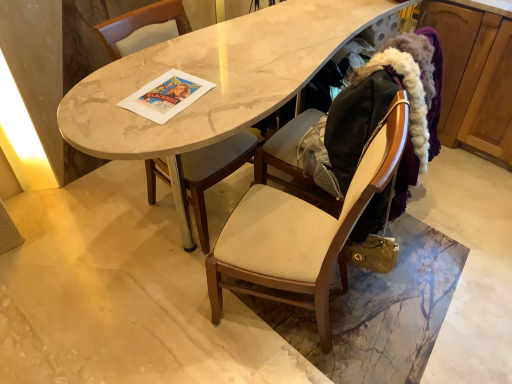
What do you see at coordinates (301, 233) in the screenshot? I see `beige fabric chair at center, marked as the 2th chair in a left-to-right arrangement` at bounding box center [301, 233].

Locate an element on the screen. The image size is (512, 384). marble table at center is located at coordinates (213, 82).

Describe the element at coordinates (474, 79) in the screenshot. I see `wooden cabinet at right` at that location.

What do you see at coordinates (383, 115) in the screenshot?
I see `beige fabric folding chair at right` at bounding box center [383, 115].

You are a GUI agent. You are given a task and a screenshot of the screen. Output one action in this format:
    pyautogui.click(x=<x>, y=<y>)
    Task: Click on the beige fabric folding chair at right
    
    Given the screenshot: What is the action you would take?
    pyautogui.click(x=383, y=115)

What do you see at coordinates (214, 173) in the screenshot?
I see `matte gray cushioned chair at center, which appears as the 2th chair when viewed from the right` at bounding box center [214, 173].

Locate an element on the screen. This screenshot has height=384, width=512. beige fabric chair at center, marked as the 2th chair in a left-to-right arrangement is located at coordinates (301, 233).

From the image's perspective, which one is positioned lower, matte gray cushioned chair at center, which appears as the 2th chair when viewed from the right, or beige fabric chair at center, marked as the 2th chair in a left-to-right arrangement?

From the image's view, beige fabric chair at center, marked as the 2th chair in a left-to-right arrangement, is below.

From a real-world perspective, is matte gray cushioned chair at center, which appears as the 2th chair when viewed from the right, physically above beige fabric chair at center, the first chair in the right-to-left sequence?

No, from a real-world perspective, matte gray cushioned chair at center, which appears as the 2th chair when viewed from the right, is not over beige fabric chair at center, the first chair in the right-to-left sequence

Could you tell me if matte gray cushioned chair at center, marked as the first chair in a left-to-right arrangement, is facing beige fabric chair at center, marked as the 2th chair in a left-to-right arrangement?

Yes, matte gray cushioned chair at center, marked as the first chair in a left-to-right arrangement, is oriented towards beige fabric chair at center, marked as the 2th chair in a left-to-right arrangement.

In the scene shown: Is beige fabric chair at center, marked as the 2th chair in a left-to-right arrangement, at the left side of beige fabric folding chair at right?

Correct, you'll find beige fabric chair at center, marked as the 2th chair in a left-to-right arrangement, to the left of beige fabric folding chair at right.

Is beige fabric chair at center, marked as the 2th chair in a left-to-right arrangement, wider than beige fabric folding chair at right?

In fact, beige fabric chair at center, marked as the 2th chair in a left-to-right arrangement, might be narrower than beige fabric folding chair at right.

From the image's perspective, is beige fabric chair at center, the first chair in the right-to-left sequence, on top of beige fabric folding chair at right?

No, from the image's perspective, beige fabric chair at center, the first chair in the right-to-left sequence, is not over beige fabric folding chair at right.

From the image's perspective, relative to marble table at center, is matte gray cushioned chair at center, which appears as the 2th chair when viewed from the right, above or below?

Clearly, from the image's perspective, matte gray cushioned chair at center, which appears as the 2th chair when viewed from the right, is below marble table at center.

Is matte gray cushioned chair at center, which appears as the 2th chair when viewed from the right, in contact with marble table at center?

No, matte gray cushioned chair at center, which appears as the 2th chair when viewed from the right, is not beside marble table at center.

Considering the sizes of matte gray cushioned chair at center, marked as the first chair in a left-to-right arrangement, and marble table at center in the image, is matte gray cushioned chair at center, marked as the first chair in a left-to-right arrangement, wider or thinner than marble table at center?

In the image, matte gray cushioned chair at center, marked as the first chair in a left-to-right arrangement, appears to be more narrow than marble table at center.

Which of these two, matte gray cushioned chair at center, marked as the first chair in a left-to-right arrangement, or wooden cabinet at right, stands shorter?

wooden cabinet at right.

In the scene shown: Considering the positions of objects matte gray cushioned chair at center, which appears as the 2th chair when viewed from the right, and wooden cabinet at right in the image provided, who is more to the left, matte gray cushioned chair at center, which appears as the 2th chair when viewed from the right, or wooden cabinet at right?

Positioned to the left is matte gray cushioned chair at center, which appears as the 2th chair when viewed from the right.

From a real-world perspective, is matte gray cushioned chair at center, marked as the first chair in a left-to-right arrangement, physically located above or below wooden cabinet at right?

In terms of real-world spatial position, matte gray cushioned chair at center, marked as the first chair in a left-to-right arrangement, is above wooden cabinet at right.

Considering the positions of point (218, 36) and point (482, 84), is point (218, 36) closer or farther from the camera than point (482, 84)?

Clearly, point (218, 36) is closer to the camera than point (482, 84).

Does marble table at center turn towards wooden cabinet at right?

Yes.

Is marble table at center placed right next to wooden cabinet at right?

marble table at center and wooden cabinet at right are clearly separated.

From the image's perspective, who appears lower, marble table at center or wooden cabinet at right?

marble table at center.

Considering the sizes of wooden cabinet at right and matte gray cushioned chair at center, marked as the first chair in a left-to-right arrangement, in the image, is wooden cabinet at right taller or shorter than matte gray cushioned chair at center, marked as the first chair in a left-to-right arrangement,?

In the image, wooden cabinet at right appears to be shorter than matte gray cushioned chair at center, marked as the first chair in a left-to-right arrangement.

From the image's perspective, is wooden cabinet at right beneath matte gray cushioned chair at center, which appears as the 2th chair when viewed from the right?

No, from the image's perspective, wooden cabinet at right is not below matte gray cushioned chair at center, which appears as the 2th chair when viewed from the right.

Which is in front, wooden cabinet at right or matte gray cushioned chair at center, which appears as the 2th chair when viewed from the right?

matte gray cushioned chair at center, which appears as the 2th chair when viewed from the right.

Which is more to the right, wooden cabinet at right or matte gray cushioned chair at center, marked as the first chair in a left-to-right arrangement?

From the viewer's perspective, wooden cabinet at right appears more on the right side.

Can you confirm if beige fabric folding chair at right is taller than wooden cabinet at right?

Yes, beige fabric folding chair at right is taller than wooden cabinet at right.

How different are the orientations of beige fabric folding chair at right and wooden cabinet at right in degrees?

There is a 2.33-degree angle between the facing directions of beige fabric folding chair at right and wooden cabinet at right.

Is beige fabric folding chair at right directly adjacent to wooden cabinet at right?

No, beige fabric folding chair at right is not beside wooden cabinet at right.

Would you say beige fabric folding chair at right is outside wooden cabinet at right?

Yes.

At what (x,y) coordinates should I click in order to perform the action: click on chair above the matte gray cushioned chair at center, marked as the first chair in a left-to-right arrangement (from a real-world perspective). Please return your answer as a coordinate pair (x, y). The image size is (512, 384). Looking at the image, I should click on (301, 233).

Identify the location of folding chair on the right of beige fabric chair at center, the first chair in the right-to-left sequence. This screenshot has width=512, height=384. (383, 115).

From the image, which object appears to be nearer to matte gray cushioned chair at center, which appears as the 2th chair when viewed from the right, beige fabric folding chair at right or beige fabric chair at center, marked as the 2th chair in a left-to-right arrangement?

The object closer to matte gray cushioned chair at center, which appears as the 2th chair when viewed from the right, is beige fabric chair at center, marked as the 2th chair in a left-to-right arrangement.

When comparing their distances from beige fabric chair at center, the first chair in the right-to-left sequence, does wooden cabinet at right or matte gray cushioned chair at center, which appears as the 2th chair when viewed from the right, seem closer?

matte gray cushioned chair at center, which appears as the 2th chair when viewed from the right, is positioned closer to the anchor beige fabric chair at center, the first chair in the right-to-left sequence.

Based on their spatial positions, is beige fabric chair at center, marked as the 2th chair in a left-to-right arrangement, or marble table at center further from wooden cabinet at right?

beige fabric chair at center, marked as the 2th chair in a left-to-right arrangement, is further to wooden cabinet at right.

Which object lies further to the anchor point marble table at center, beige fabric chair at center, marked as the 2th chair in a left-to-right arrangement, or beige fabric folding chair at right?

beige fabric chair at center, marked as the 2th chair in a left-to-right arrangement, is further to marble table at center.

Which object lies further to the anchor point beige fabric chair at center, marked as the 2th chair in a left-to-right arrangement, wooden cabinet at right or marble table at center?

The object further to beige fabric chair at center, marked as the 2th chair in a left-to-right arrangement, is wooden cabinet at right.

When comparing their distances from beige fabric chair at center, the first chair in the right-to-left sequence, does marble table at center or beige fabric folding chair at right seem further?

marble table at center is further to beige fabric chair at center, the first chair in the right-to-left sequence.

Which object lies further to the anchor point matte gray cushioned chair at center, which appears as the 2th chair when viewed from the right, marble table at center or wooden cabinet at right?

Among the two, wooden cabinet at right is located further to matte gray cushioned chair at center, which appears as the 2th chair when viewed from the right.

Estimate the real-world distances between objects in this image. Which object is further from wooden cabinet at right, beige fabric chair at center, marked as the 2th chair in a left-to-right arrangement, or matte gray cushioned chair at center, which appears as the 2th chair when viewed from the right?

beige fabric chair at center, marked as the 2th chair in a left-to-right arrangement, is further to wooden cabinet at right.

Find the location of a particular element. desk situated between beige fabric chair at center, the first chair in the right-to-left sequence, and wooden cabinet at right from left to right is located at coordinates (213, 82).

You are a GUI agent. You are given a task and a screenshot of the screen. Output one action in this format:
    pyautogui.click(x=<x>, y=<y>)
    Task: Click on the chair situated between matte gray cushioned chair at center, marked as the first chair in a left-to-right arrangement, and beige fabric folding chair at right from left to right
    
    Given the screenshot: What is the action you would take?
    pyautogui.click(x=301, y=233)

Find the location of `folding chair between marble table at center and beige fabric chair at center, marked as the 2th chair in a left-to-right arrangement, in the vertical direction`. folding chair between marble table at center and beige fabric chair at center, marked as the 2th chair in a left-to-right arrangement, in the vertical direction is located at coordinates (383, 115).

Identify the location of desk between matte gray cushioned chair at center, which appears as the 2th chair when viewed from the right, and beige fabric folding chair at right from left to right. The height and width of the screenshot is (384, 512). (213, 82).